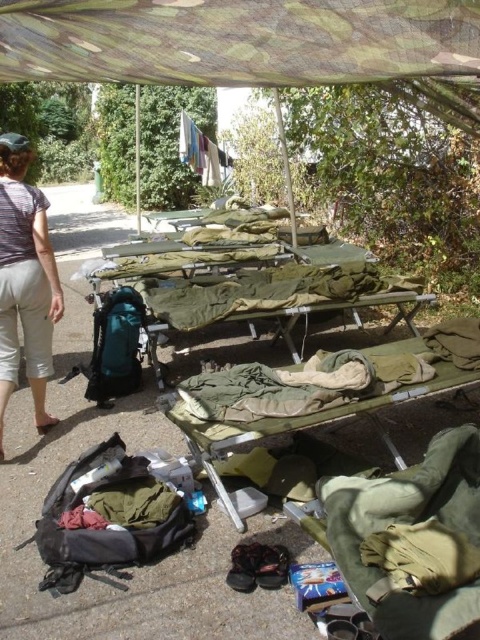
Which of these two, camouflage fabric canopy at upper center or camouflage fabric cot at center, stands taller?

Standing taller between the two is camouflage fabric cot at center.

From the picture: Is camouflage fabric canopy at upper center above camouflage fabric cot at center?

Correct, camouflage fabric canopy at upper center is located above camouflage fabric cot at center.

Identify the location of camouflage fabric canopy at upper center. The image size is (480, 640). (238, 40).

Can you confirm if camouflage fabric cot at center is positioned to the left of light gray cotton pants at left?

Incorrect, camouflage fabric cot at center is not on the left side of light gray cotton pants at left.

Can you confirm if camouflage fabric cot at center is taller than light gray cotton pants at left?

No.

Which is in front, point (297, 419) or point (48, 417)?

Point (297, 419) is more forward.

You are a GUI agent. You are given a task and a screenshot of the screen. Output one action in this format:
    pyautogui.click(x=<x>, y=<y>)
    Task: Click on the camouflage fabric cot at center
    The width and height of the screenshot is (480, 640).
    Given the screenshot: What is the action you would take?
    pyautogui.click(x=319, y=392)

Can you confirm if camouflage fabric canopy at upper center is wider than light gray cotton pants at left?

Correct, the width of camouflage fabric canopy at upper center exceeds that of light gray cotton pants at left.

Between point (402, 24) and point (26, 145), which one is positioned in front?

Point (402, 24) is in front.

What do you see at coordinates (238, 40) in the screenshot?
I see `camouflage fabric canopy at upper center` at bounding box center [238, 40].

Find the location of a particular element. camouflage fabric canopy at upper center is located at coordinates (238, 40).